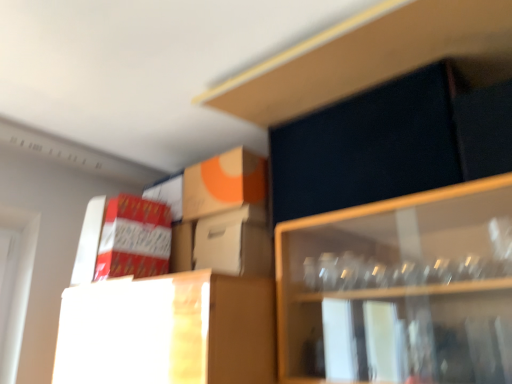
Question: Considering the relative sizes of white cardboard box at center, which appears as the first cardboard box when viewed from the right, and orange matte cardboard box at upper center, which is the second cardboard box in right-to-left order, in the image provided, is white cardboard box at center, which appears as the first cardboard box when viewed from the right, shorter than orange matte cardboard box at upper center, which is the second cardboard box in right-to-left order,?

Choices:
 (A) no
 (B) yes

Answer: (B)

Question: Is white cardboard box at center, which appears as the first cardboard box when viewed from the right, surrounding orange matte cardboard box at upper center, which is the second cardboard box in right-to-left order?

Choices:
 (A) no
 (B) yes

Answer: (A)

Question: Is white cardboard box at center, which appears as the first cardboard box when viewed from the right, oriented away from orange matte cardboard box at upper center, which is the second cardboard box in right-to-left order?

Choices:
 (A) yes
 (B) no

Answer: (B)

Question: From a real-world perspective, is white cardboard box at center, which appears as the first cardboard box when viewed from the right, positioned over orange matte cardboard box at upper center, placed as the 2th cardboard box when sorted from left to right, based on gravity?

Choices:
 (A) no
 (B) yes

Answer: (A)

Question: Is white cardboard box at center, marked as the 3th cardboard box in a left-to-right arrangement, bigger than orange matte cardboard box at upper center, which is the second cardboard box in right-to-left order?

Choices:
 (A) no
 (B) yes

Answer: (A)

Question: Is white cardboard box at center, which appears as the first cardboard box when viewed from the right, facing towards orange matte cardboard box at upper center, placed as the 2th cardboard box when sorted from left to right?

Choices:
 (A) no
 (B) yes

Answer: (A)

Question: Could you tell me if red cardboard box at left, the first cardboard box viewed from the left, is facing orange matte cardboard box at upper center, which is the second cardboard box in right-to-left order?

Choices:
 (A) no
 (B) yes

Answer: (A)

Question: Is red cardboard box at left, placed as the 3th cardboard box when sorted from right to left, outside orange matte cardboard box at upper center, which is the second cardboard box in right-to-left order?

Choices:
 (A) no
 (B) yes

Answer: (B)

Question: Is the surface of red cardboard box at left, placed as the 3th cardboard box when sorted from right to left, in direct contact with orange matte cardboard box at upper center, placed as the 2th cardboard box when sorted from left to right?

Choices:
 (A) no
 (B) yes

Answer: (A)

Question: Is orange matte cardboard box at upper center, placed as the 2th cardboard box when sorted from left to right, inside red cardboard box at left, placed as the 3th cardboard box when sorted from right to left?

Choices:
 (A) yes
 (B) no

Answer: (B)

Question: Is red cardboard box at left, placed as the 3th cardboard box when sorted from right to left, to the right of orange matte cardboard box at upper center, placed as the 2th cardboard box when sorted from left to right, from the viewer's perspective?

Choices:
 (A) no
 (B) yes

Answer: (A)

Question: From a real-world perspective, is red cardboard box at left, placed as the 3th cardboard box when sorted from right to left, physically above orange matte cardboard box at upper center, which is the second cardboard box in right-to-left order?

Choices:
 (A) yes
 (B) no

Answer: (B)

Question: Would you say white cardboard box at center, which appears as the first cardboard box when viewed from the right, contains dark matte cabinet at upper right?

Choices:
 (A) yes
 (B) no

Answer: (B)